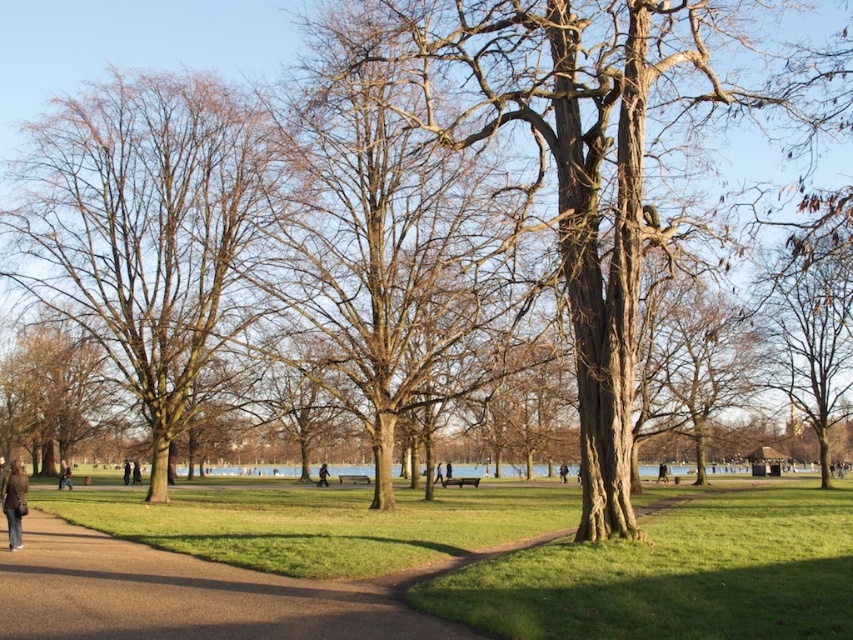
Who is shorter, smooth brown tree trunk at center or brown rough bark tree at upper right?

brown rough bark tree at upper right is shorter.

Is the position of smooth brown tree trunk at center more distant than that of brown rough bark tree at upper right?

No, smooth brown tree trunk at center is in front of brown rough bark tree at upper right.

Does point (579, 326) lie in front of point (830, 346)?

Yes, it is.

The width and height of the screenshot is (853, 640). Identify the location of smooth brown tree trunk at center. (561, 154).

Is point (770, 330) closer to camera compared to point (74, 417)?

Yes, point (770, 330) is closer to viewer.

Who is positioned more to the right, brown rough bark tree at upper right or brown rough tree at left?

brown rough bark tree at upper right

Who is more distant from viewer, (817, 237) or (55, 376)?

The point (55, 376) is behind.

The image size is (853, 640). I want to click on brown rough bark tree at upper right, so click(x=810, y=330).

Between brown rough tree at left and dark brown leather jacket at lower left, which one appears on the right side from the viewer's perspective?

Positioned to the right is brown rough tree at left.

Does brown rough tree at left appear on the right side of dark brown leather jacket at lower left?

Correct, you'll find brown rough tree at left to the right of dark brown leather jacket at lower left.

Where is `brown rough tree at left`? The height and width of the screenshot is (640, 853). brown rough tree at left is located at coordinates [x=54, y=394].